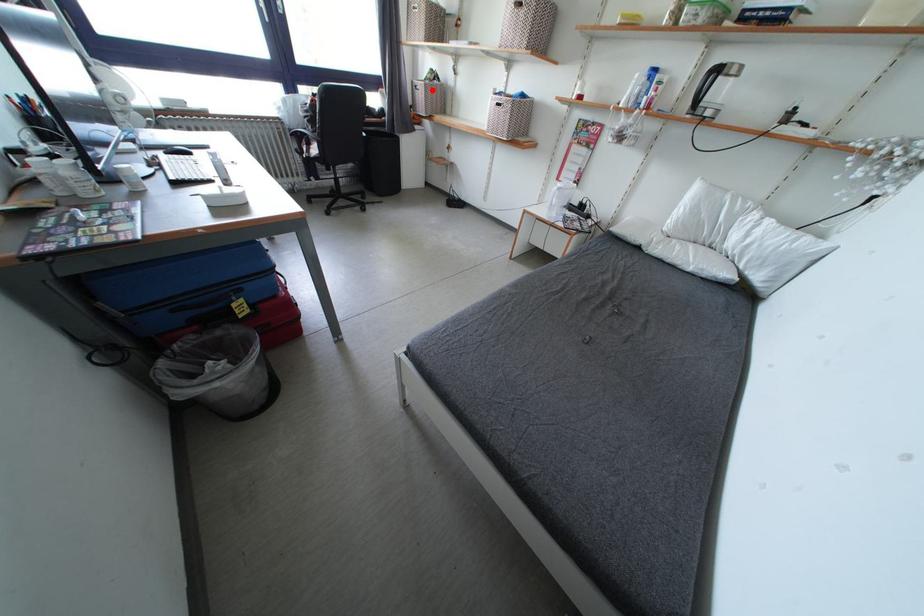
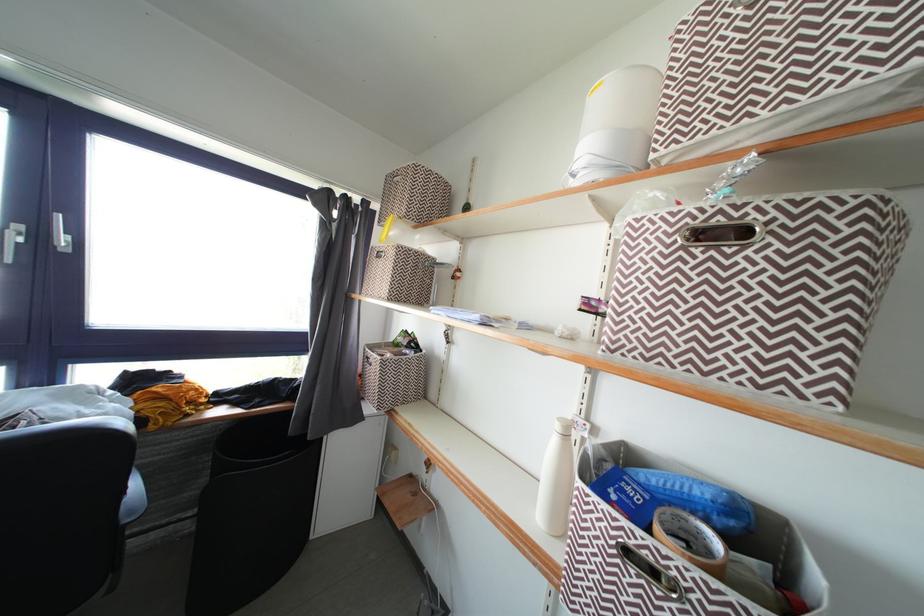
Find the pixel in the second image that matches the highlighted location in the first image.

(390, 367)